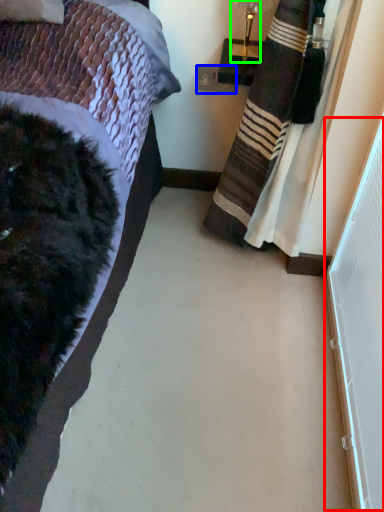
Question: Based on their relative distances, which object is farther from screen door (highlighted by a red box)? Choose from power outlet (highlighted by a blue box) and lamp (highlighted by a green box).

Choices:
 (A) power outlet
 (B) lamp

Answer: (A)